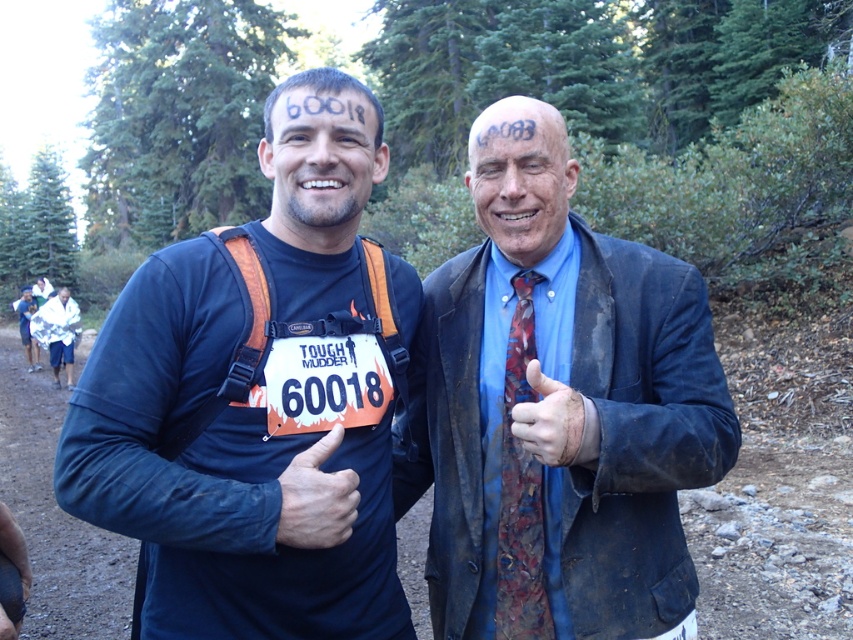
You are a photographer taking a picture of the two participants in the Tough Mudder event. You notice the matte black face at center and the matte blue thumb at center. Which object should you focus on first if you want to capture the participant on the left?

The matte black face at center is to the left of the matte blue thumb at center, so you should focus on the matte black face at center first to capture the participant on the left.